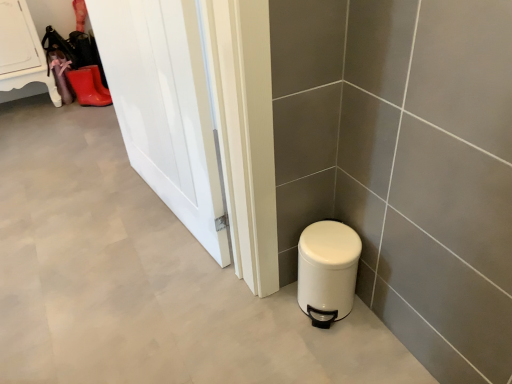
Where is `free space in front of white glossy door at left`? The height and width of the screenshot is (384, 512). free space in front of white glossy door at left is located at coordinates (130, 259).